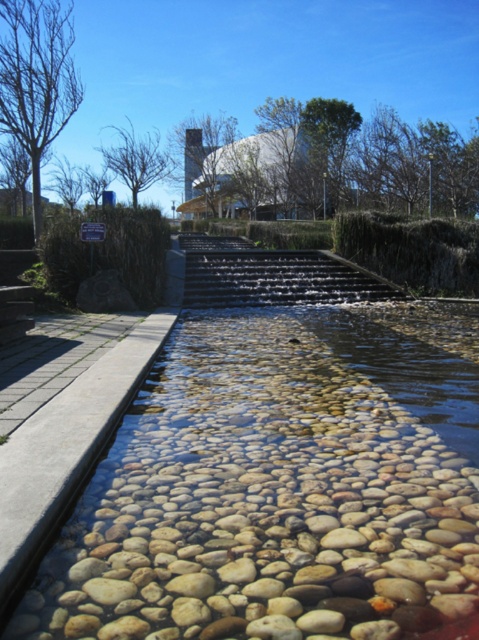
You are a person who is 1.8 meters tall. You want to cross the water feature but need to use the stairs. Which set of stairs, the black stone stairs at center or the smooth concrete stairs at lower left, will allow you to step onto them without bending down?

The black stone stairs at center is much taller than the smooth concrete stairs at lower left, so you should use the black stone stairs at center to step onto them without bending down since they are higher.

Looking at this image, you are a maintenance worker tasked with checking the water level in the translucent pebbles at center and the smooth concrete stairs at lower left. Which object is taller?

The translucent pebbles at center has a lesser height compared to smooth concrete stairs at lower left, so the smooth concrete stairs at lower left is taller.

In the scene shown: You are standing at the point with coordinates point (391, 289) and want to walk to the point with coordinates point (387, 445). Which direction should you face to walk towards your destination?

You should face forward because point (387, 445) is in front of point (391, 289).